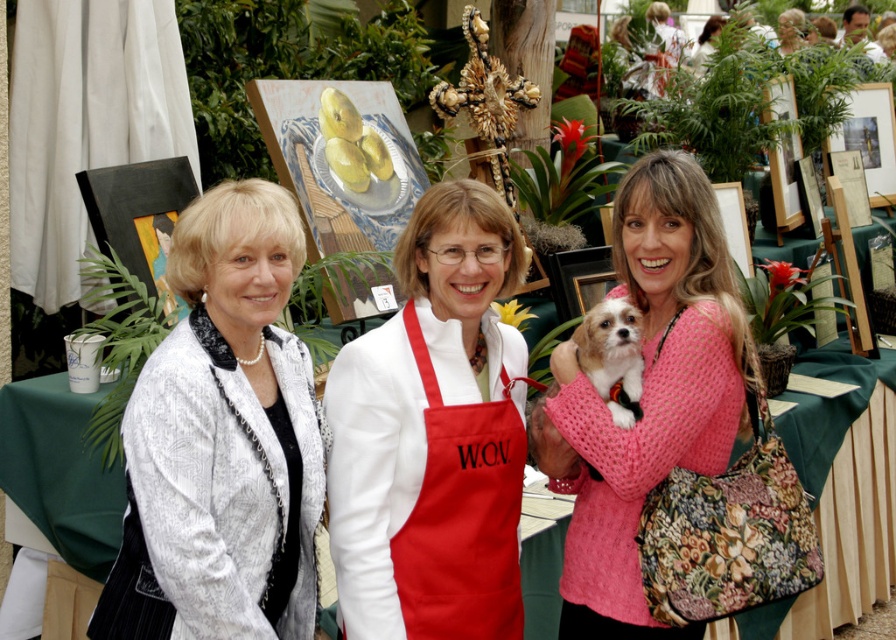
Question: Is white matte apron at center smaller than white fluffy dog at center?

Choices:
 (A) yes
 (B) no

Answer: (B)

Question: Which point is farther to the camera?

Choices:
 (A) white fluffy dog at center
 (B) white matte apron at center
 (C) pink knitted sweater at center

Answer: (A)

Question: Among these objects, which one is farthest from the camera?

Choices:
 (A) pink knitted sweater at center
 (B) white fluffy dog at center
 (C) white textured jacket at center

Answer: (B)

Question: Which object appears farthest from the camera in this image?

Choices:
 (A) white textured jacket at center
 (B) white fluffy dog at center
 (C) green fabric table at center

Answer: (C)

Question: Does white textured jacket at center appear on the left side of green fabric table at center?

Choices:
 (A) no
 (B) yes

Answer: (B)

Question: Does white textured jacket at center have a greater width compared to white fluffy dog at center?

Choices:
 (A) no
 (B) yes

Answer: (B)